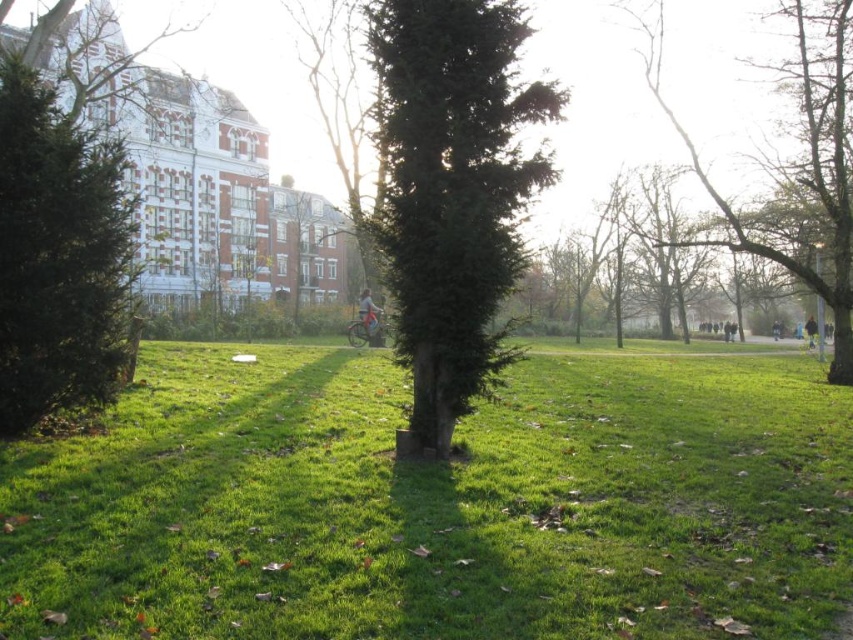
Is green grassy at center to the right of green textured tree at center from the viewer's perspective?

Yes, green grassy at center is to the right of green textured tree at center.

Is green grassy at center thinner than green textured tree at center?

No.

This screenshot has width=853, height=640. I want to click on green grassy at center, so click(437, 506).

Can you confirm if green grassy at center is taller than dark blue jacket at right?

Incorrect, green grassy at center's height is not larger of dark blue jacket at right's.

Describe the element at coordinates (437, 506) in the screenshot. I see `green grassy at center` at that location.

Is point (428, 515) positioned behind point (811, 339)?

No, (428, 515) is in front of (811, 339).

Where is `green grassy at center`? The image size is (853, 640). green grassy at center is located at coordinates (437, 506).

Does bare branches tree at upper right have a greater height compared to dark blue jacket at right?

Yes.

Is bare branches tree at upper right to the left of dark blue jacket at right from the viewer's perspective?

Correct, you'll find bare branches tree at upper right to the left of dark blue jacket at right.

Is point (846, 304) farther from viewer compared to point (809, 339)?

No, it is not.

Where is `bare branches tree at upper right`? bare branches tree at upper right is located at coordinates (796, 168).